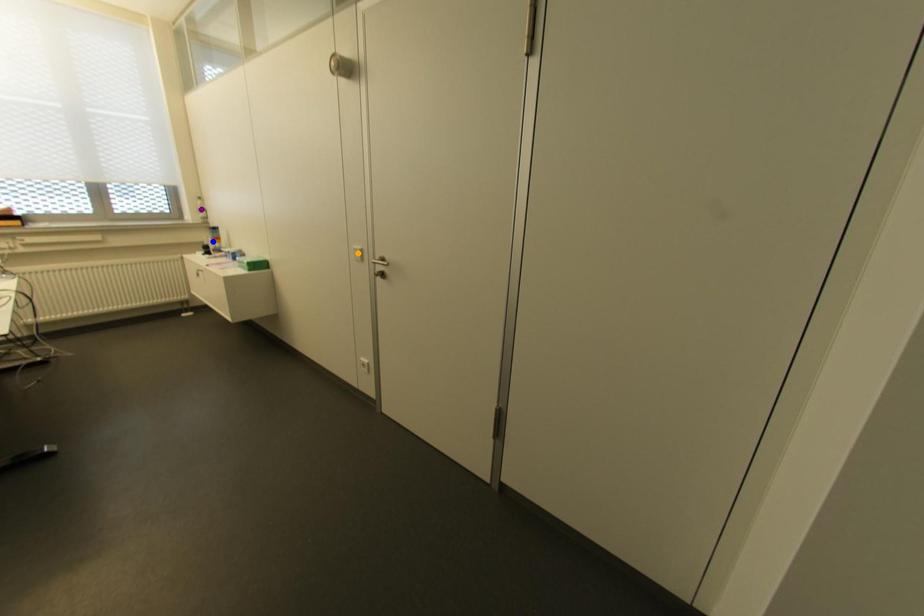
Consider the image. Order these from nearest to farthest:
A) purple point
B) blue point
C) orange point

purple point < blue point < orange point